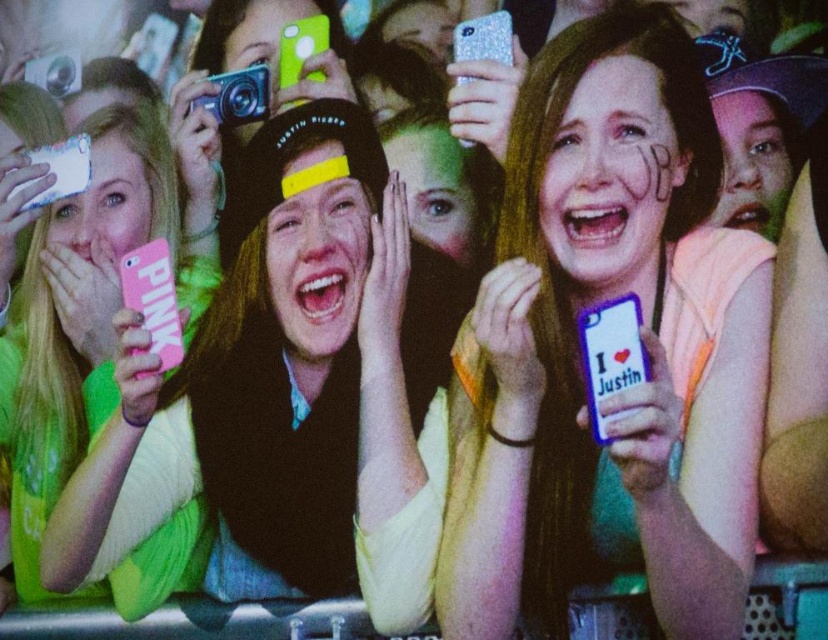
Is white glossy phone at center taller than pink matte phone at center?

Yes, white glossy phone at center is taller than pink matte phone at center.

Is white glossy phone at center positioned before pink matte phone at center?

Yes, it is.

This screenshot has width=828, height=640. What do you see at coordinates (576, 352) in the screenshot?
I see `white glossy phone at center` at bounding box center [576, 352].

Locate an element on the screen. The width and height of the screenshot is (828, 640). white glossy phone at center is located at coordinates (576, 352).

Does white glossy phone at center have a larger size compared to pink matte phone at left?

Actually, white glossy phone at center might be smaller than pink matte phone at left.

Is white glossy phone at center to the right of pink matte phone at left from the viewer's perspective?

Yes, white glossy phone at center is to the right of pink matte phone at left.

Is point (599, 300) in front of point (31, 268)?

That is True.

Locate an element on the screen. This screenshot has height=640, width=828. white glossy phone at center is located at coordinates (576, 352).

Which of these two, pink matte phone at center or pink matte phone at left, stands taller?

Standing taller between the two is pink matte phone at left.

Between point (337, 368) and point (49, 500), which one is positioned in front?

Point (337, 368)

What do you see at coordinates (290, 394) in the screenshot?
I see `pink matte phone at center` at bounding box center [290, 394].

Locate an element on the screen. The height and width of the screenshot is (640, 828). pink matte phone at center is located at coordinates (290, 394).